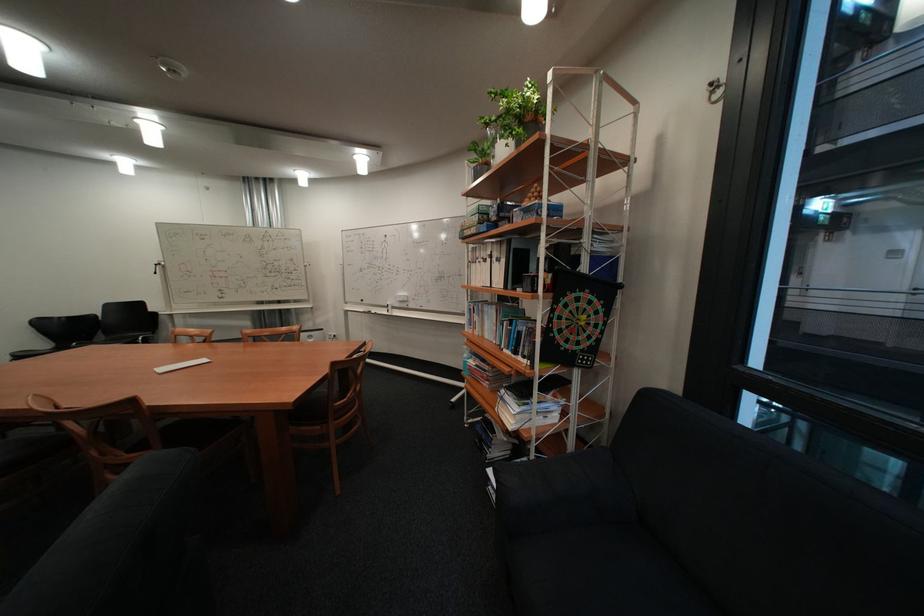
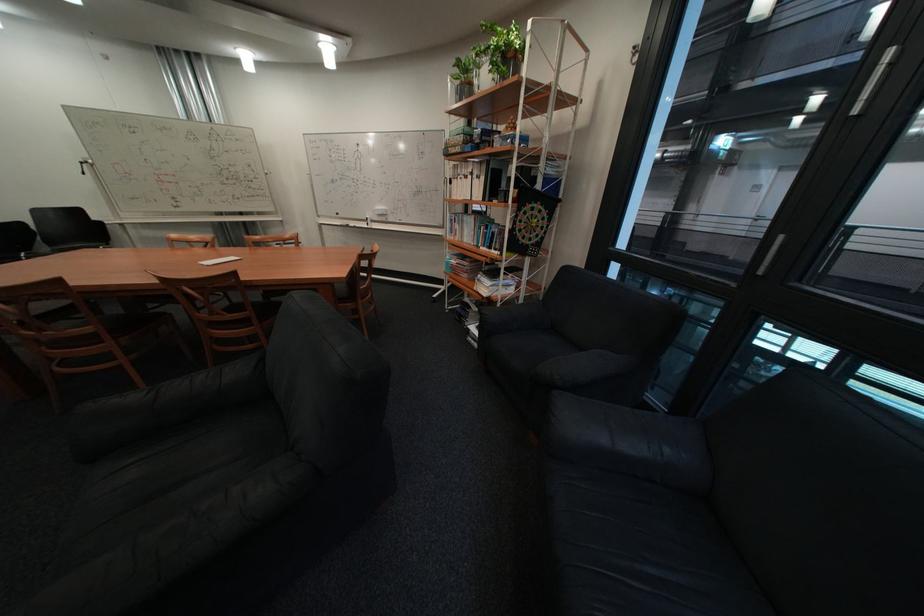
The point at (535, 333) is marked in the first image. Where is the corresponding point in the second image?

(508, 233)